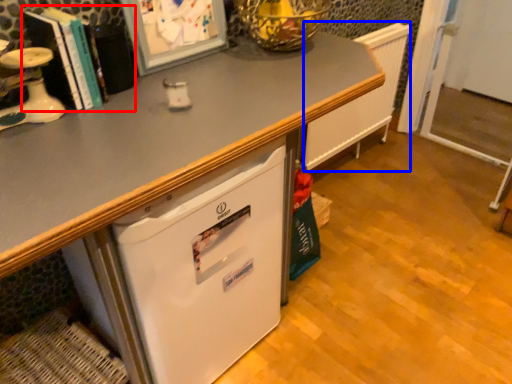
Question: Which object appears farthest to the camera in this image, book (highlighted by a red box) or radiator (highlighted by a blue box)?

Choices:
 (A) book
 (B) radiator

Answer: (B)